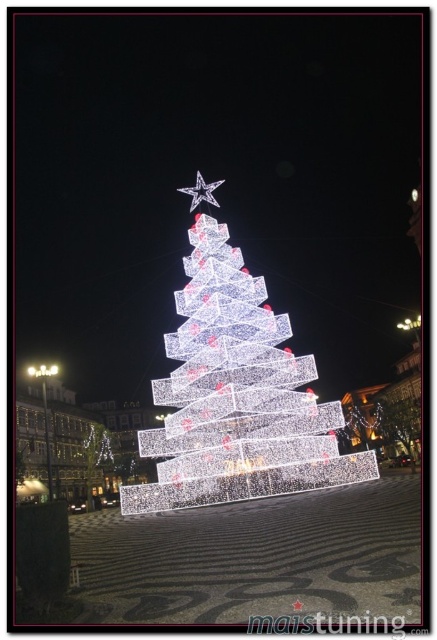
Is illuminated wireframe at center shorter than illuminated wireframe tree at center?

No.

Between point (236, 448) and point (90, 506), which one is positioned in front?

Positioned in front is point (236, 448).

Between point (198, 394) and point (92, 452), which one is positioned in front?

Positioned in front is point (198, 394).

Identify the location of illuminated wireframe at center. (235, 396).

Between point (228, 275) and point (201, 186), which one is positioned behind?

Positioned behind is point (201, 186).

Is illuminated wireframe at center taller than metallic silver star at upper center?

Correct, illuminated wireframe at center is much taller as metallic silver star at upper center.

Which is behind, point (263, 316) or point (201, 180)?

Positioned behind is point (201, 180).

Where is `illuminated wireframe at center`? The height and width of the screenshot is (640, 437). illuminated wireframe at center is located at coordinates (235, 396).

Does illuminated wireframe tree at center have a larger size compared to metallic silver star at upper center?

No, illuminated wireframe tree at center is not bigger than metallic silver star at upper center.

Does illuminated wireframe tree at center have a greater width compared to metallic silver star at upper center?

No, illuminated wireframe tree at center is not wider than metallic silver star at upper center.

Is point (87, 499) farther from camera compared to point (207, 195)?

No, (87, 499) is closer to viewer.

Find the location of `illuminated wireframe tree at center`. illuminated wireframe tree at center is located at coordinates (94, 458).